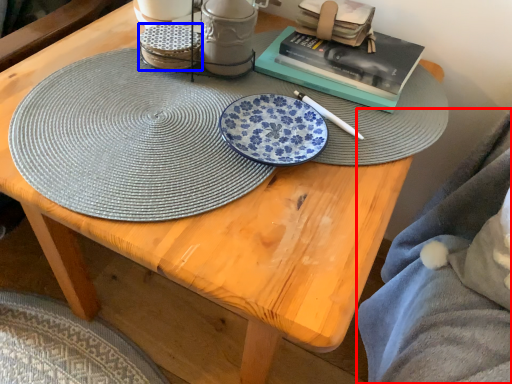
Question: Which object is further to the camera taking this photo, blanket (highlighted by a red box) or tableware (highlighted by a blue box)?

Choices:
 (A) blanket
 (B) tableware

Answer: (B)